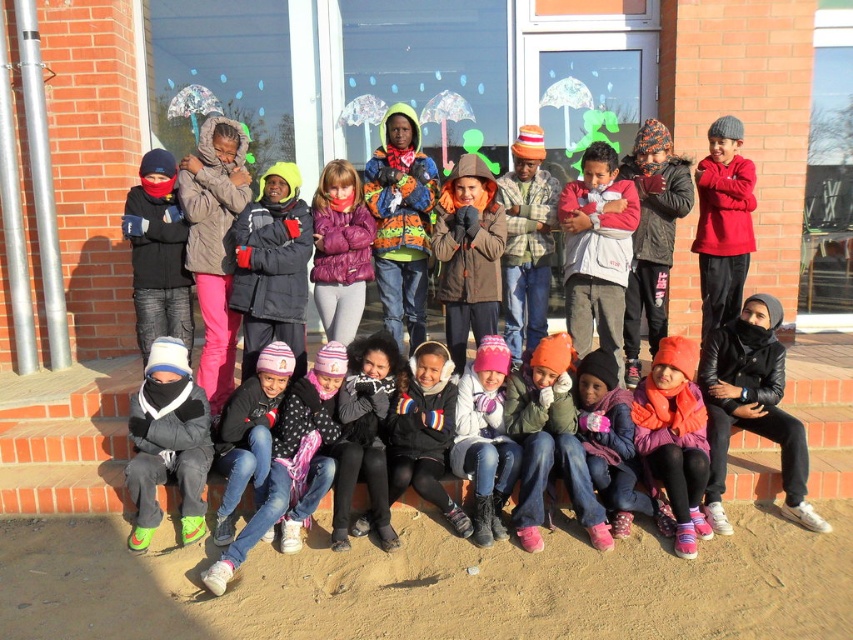
The height and width of the screenshot is (640, 853). Find the location of `black leather jacket at lower right`. black leather jacket at lower right is located at coordinates (752, 406).

Is point (769, 358) positioned after point (515, 449)?

Yes, point (769, 358) is farther from viewer.

Find the location of a particular element. black leather jacket at lower right is located at coordinates (752, 406).

Who is more forward, (691, 420) or (357, 188)?

Point (691, 420) is more forward.

Does orange fleece scarf at center appear under purple puffy jacket at center?

Correct, orange fleece scarf at center is located below purple puffy jacket at center.

Based on the photo, who is more forward, (674, 460) or (352, 321)?

Positioned in front is point (674, 460).

Identify the location of orange fleece scarf at center. (675, 436).

Is the position of pink woolen hat at center less distant than that of purple puffy jacket at center?

Yes, it is in front of purple puffy jacket at center.

Which is behind, point (457, 460) or point (358, 189)?

The point (358, 189) is more distant.

I want to click on pink woolen hat at center, so click(485, 438).